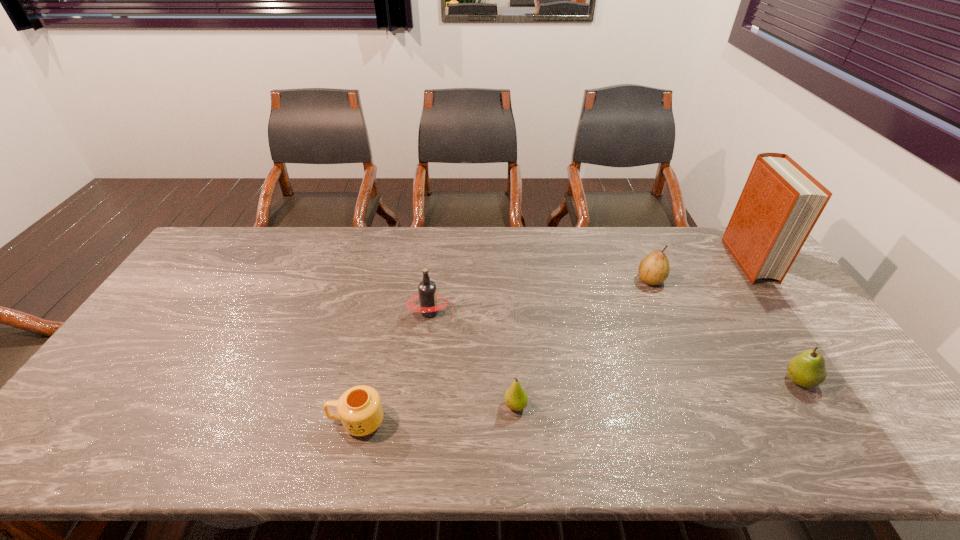
Where is `mug`? mug is located at coordinates (360, 410).

Where is `the leftmost object`? The image size is (960, 540). the leftmost object is located at coordinates (360, 410).

In order to click on vacant space located on the open cover of the hardback book in this screenshot , I will do `click(806, 339)`.

The image size is (960, 540). I want to click on vacant space located on the label of the second tallest object, so 551,312.

This screenshot has width=960, height=540. What are the coordinates of `free spot located on the back of the farthest pear` in the screenshot? It's located at (638, 253).

At what (x,y) coordinates should I click in order to perform the action: click on vacant position located 0.110m on the left of the second farthest pear. Please return your answer as a coordinate pair (x, y). Image resolution: width=960 pixels, height=540 pixels. Looking at the image, I should click on (741, 381).

Find the location of a particular element. This screenshot has width=960, height=540. blank space located on the right of the fourth object from right to left is located at coordinates (552, 406).

Locate an element on the screen. This screenshot has height=540, width=960. free region located 0.310m on the handle side of the shortest object is located at coordinates (200, 421).

This screenshot has height=540, width=960. Identify the location of vacant space situated 0.380m on the handle side of the shortest object. (170, 421).

The height and width of the screenshot is (540, 960). In order to click on vacant space located on the handle side of the shortest object in this screenshot , I will do `click(186, 421)`.